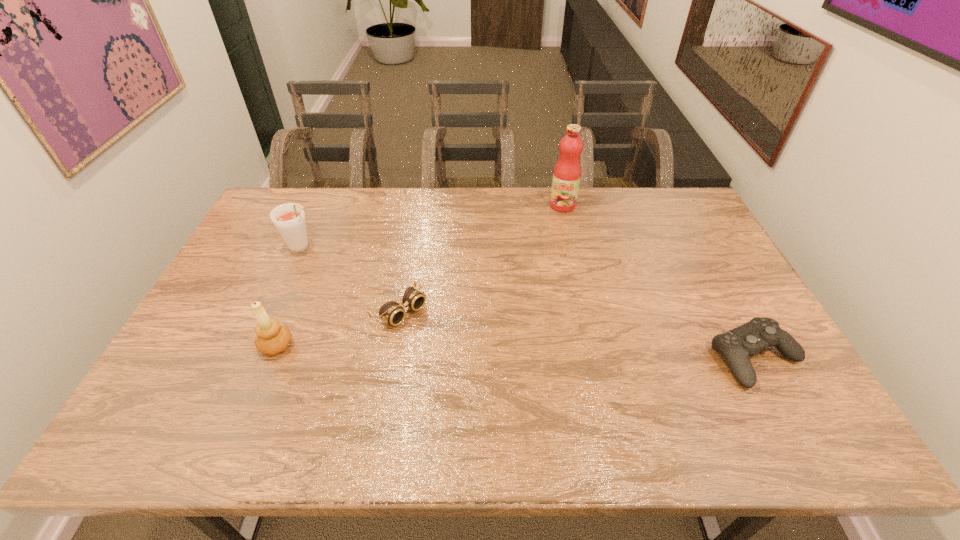
Identify the location of object that is at the near edge. The width and height of the screenshot is (960, 540). (736, 345).

Identify the location of object located in the left edge section of the desktop. (289, 219).

Where is `object that is positioned at the right edge`? This screenshot has height=540, width=960. object that is positioned at the right edge is located at coordinates (736, 345).

Find the location of a particular element. object that is positioned at the near right corner is located at coordinates (736, 345).

Where is `free spot at the far edge of the desktop`? free spot at the far edge of the desktop is located at coordinates (461, 199).

This screenshot has height=540, width=960. Identify the location of free space at the near edge. (594, 390).

At what (x,y) coordinates should I click in order to perform the action: click on vacant area at the left edge of the desktop. Please return your answer as a coordinate pair (x, y). Looking at the image, I should click on (220, 359).

Where is `vacant space at the far left corner of the desktop`? vacant space at the far left corner of the desktop is located at coordinates (294, 199).

You are a GUI agent. You are given a task and a screenshot of the screen. Output one action in this format:
    pyautogui.click(x=<x>, y=<y>)
    Task: Click on the free space at the near left corner
    
    Given the screenshot: What is the action you would take?
    pyautogui.click(x=165, y=387)

The image size is (960, 540). I want to click on free space between the second farthest object and the tallest object, so click(433, 226).